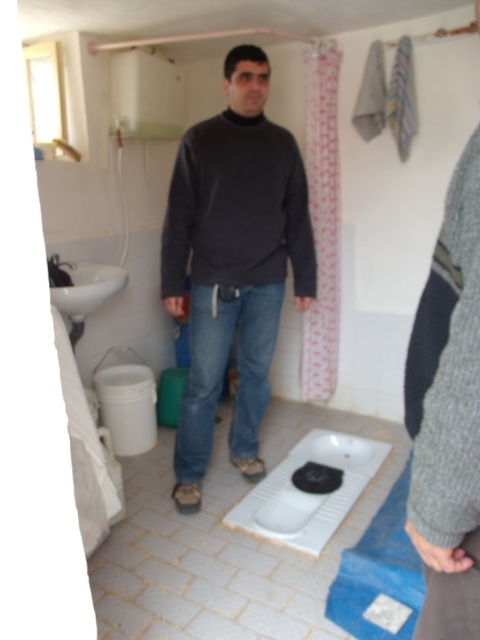
Does dark gray sweater at center have a lesser height compared to white glossy urinal at center?

In fact, dark gray sweater at center may be taller than white glossy urinal at center.

Does dark gray sweater at center appear under white glossy urinal at center?

Actually, dark gray sweater at center is above white glossy urinal at center.

Is point (183, 205) more distant than point (253, 522)?

Yes, it is.

The height and width of the screenshot is (640, 480). What are the coordinates of `dark gray sweater at center` in the screenshot? It's located at (232, 262).

Does dark gray sweater at center have a greater width compared to white glossy sink at left?

Indeed, dark gray sweater at center has a greater width compared to white glossy sink at left.

What do you see at coordinates (232, 262) in the screenshot? I see `dark gray sweater at center` at bounding box center [232, 262].

Identify the location of dark gray sweater at center. (232, 262).

Between point (350, 442) and point (61, 310), which one is positioned in front?

Point (61, 310) is more forward.

Is white glossy urinal at center smaller than white glossy sink at left?

No, white glossy urinal at center is not smaller than white glossy sink at left.

Does point (257, 490) come in front of point (99, 305)?

Yes, point (257, 490) is closer to viewer.

This screenshot has height=640, width=480. Find the location of `white glossy urinal at center`. white glossy urinal at center is located at coordinates (309, 493).